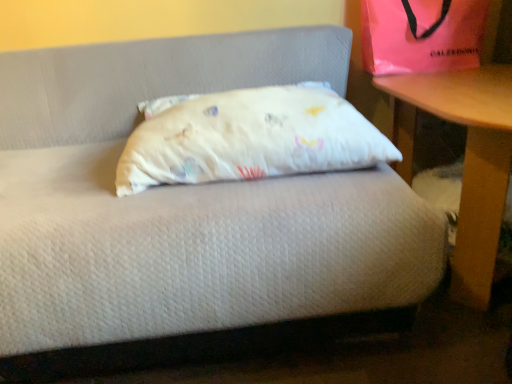
Question: Does wooden table at right turn towards pink satin bag at upper right?

Choices:
 (A) no
 (B) yes

Answer: (A)

Question: From a real-world perspective, is wooden table at right physically above pink satin bag at upper right?

Choices:
 (A) no
 (B) yes

Answer: (A)

Question: From a real-world perspective, is wooden table at right located beneath pink satin bag at upper right?

Choices:
 (A) no
 (B) yes

Answer: (B)

Question: Considering the relative positions of wooden table at right and pink satin bag at upper right in the image provided, is wooden table at right to the right of pink satin bag at upper right from the viewer's perspective?

Choices:
 (A) no
 (B) yes

Answer: (B)

Question: Is the depth of wooden table at right less than that of pink satin bag at upper right?

Choices:
 (A) yes
 (B) no

Answer: (A)

Question: From a real-world perspective, is pink satin bag at upper right physically located above or below wooden table at right?

Choices:
 (A) above
 (B) below

Answer: (A)

Question: Looking at the image, does pink satin bag at upper right seem bigger or smaller compared to wooden table at right?

Choices:
 (A) small
 (B) big

Answer: (A)

Question: Is pink satin bag at upper right to the left or to the right of wooden table at right in the image?

Choices:
 (A) right
 (B) left

Answer: (B)

Question: From the image's perspective, is pink satin bag at upper right above or below wooden table at right?

Choices:
 (A) above
 (B) below

Answer: (A)

Question: Considering the positions of pink satin bag at upper right and white cotton pillow at center in the image, is pink satin bag at upper right bigger or smaller than white cotton pillow at center?

Choices:
 (A) small
 (B) big

Answer: (A)

Question: In terms of width, does pink satin bag at upper right look wider or thinner when compared to white cotton pillow at center?

Choices:
 (A) thin
 (B) wide

Answer: (A)

Question: Would you say pink satin bag at upper right is to the left or to the right of white cotton pillow at center in the picture?

Choices:
 (A) left
 (B) right

Answer: (B)

Question: Relative to white cotton pillow at center, is pink satin bag at upper right in front or behind?

Choices:
 (A) front
 (B) behind

Answer: (B)

Question: In terms of height, does white cotton pillow at center look taller or shorter compared to wooden table at right?

Choices:
 (A) short
 (B) tall

Answer: (A)

Question: In the image, is white cotton pillow at center on the left side or the right side of wooden table at right?

Choices:
 (A) right
 (B) left

Answer: (B)